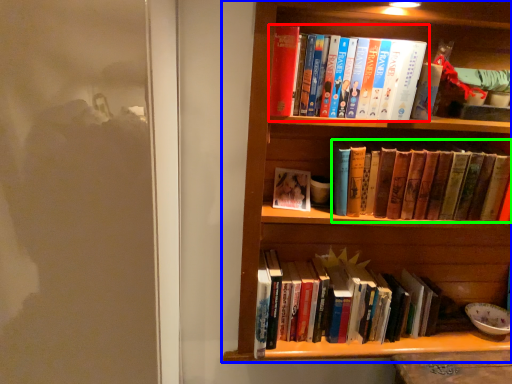
Question: Which object is positioned closest to book (highlighted by a red box)? Select from bookcase (highlighted by a blue box) and book (highlighted by a green box).

Choices:
 (A) bookcase
 (B) book

Answer: (B)